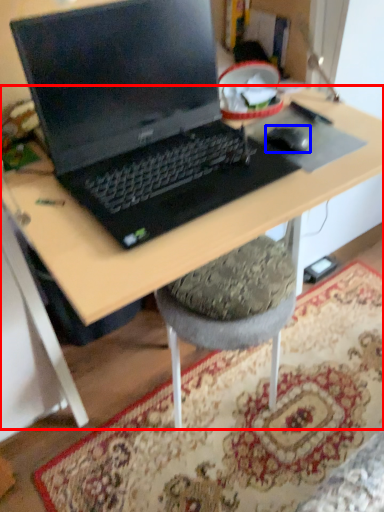
Question: Among these objects, which one is nearest to the camera, desk (highlighted by a red box) or mouse (highlighted by a blue box)?

Choices:
 (A) desk
 (B) mouse

Answer: (A)